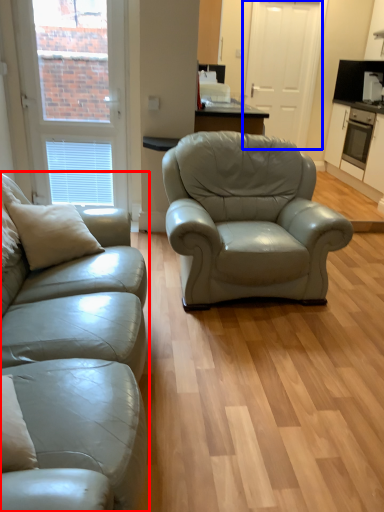
Question: Which object appears farthest to the camera in this image, studio couch (highlighted by a red box) or screen door (highlighted by a blue box)?

Choices:
 (A) studio couch
 (B) screen door

Answer: (B)